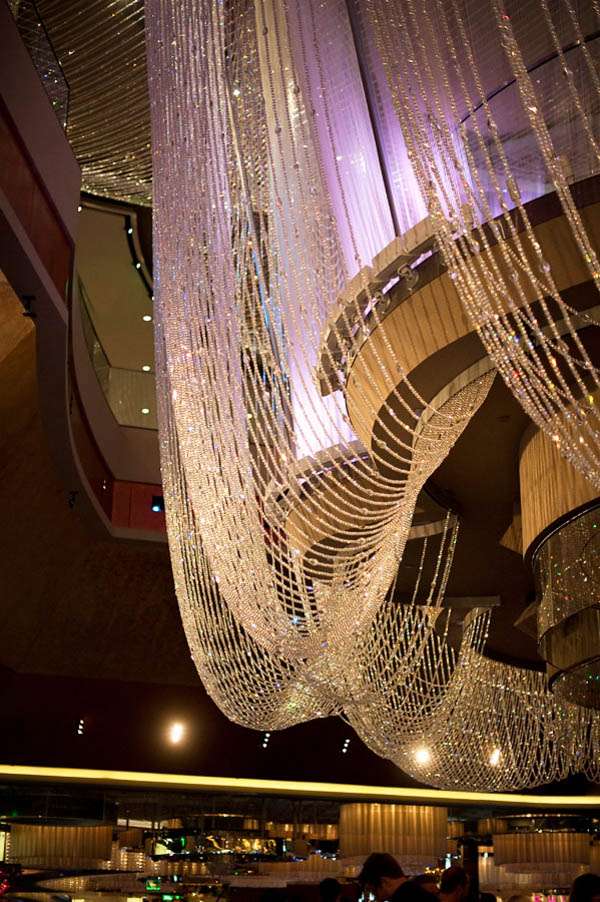
Locate an element on the screen. Image resolution: width=600 pixels, height=902 pixels. ceiling lights is located at coordinates (177, 739), (417, 759), (496, 756).